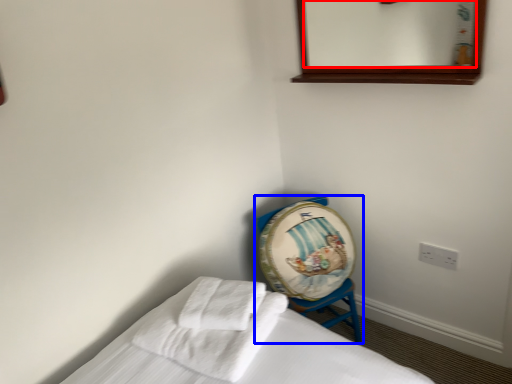
Question: Which point is further to the camera, mirror (highlighted by a red box) or furniture (highlighted by a blue box)?

Choices:
 (A) mirror
 (B) furniture

Answer: (B)